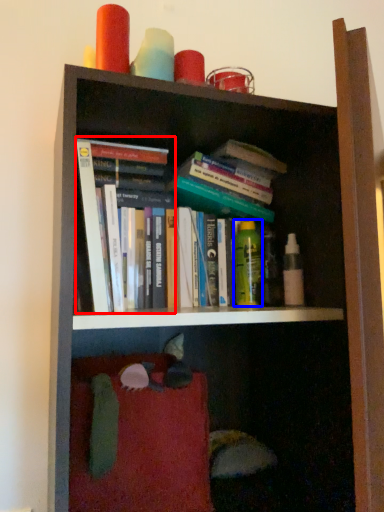
Question: Which object is closer to the camera taking this photo, book (highlighted by a red box) or toiletry (highlighted by a blue box)?

Choices:
 (A) book
 (B) toiletry

Answer: (A)